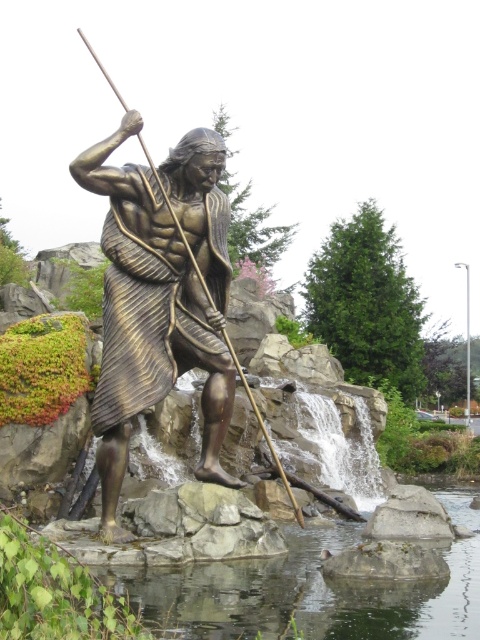
You are a tourist visiting the statue and want to take a photo of both the bronze statue at center and the clear water at center. Since you want the statue to appear to the left of the water in your photo, will the natural positioning allow this?

The bronze statue at center is positioned on the left side of clear water at center, so the natural positioning already has the statue to the left of the water, allowing the desired photo composition.

You are standing at the center of the image. Where is the bronze statue at center located relative to your position?

The bronze statue at center is located at point (158, 298) relative to the center of the image.